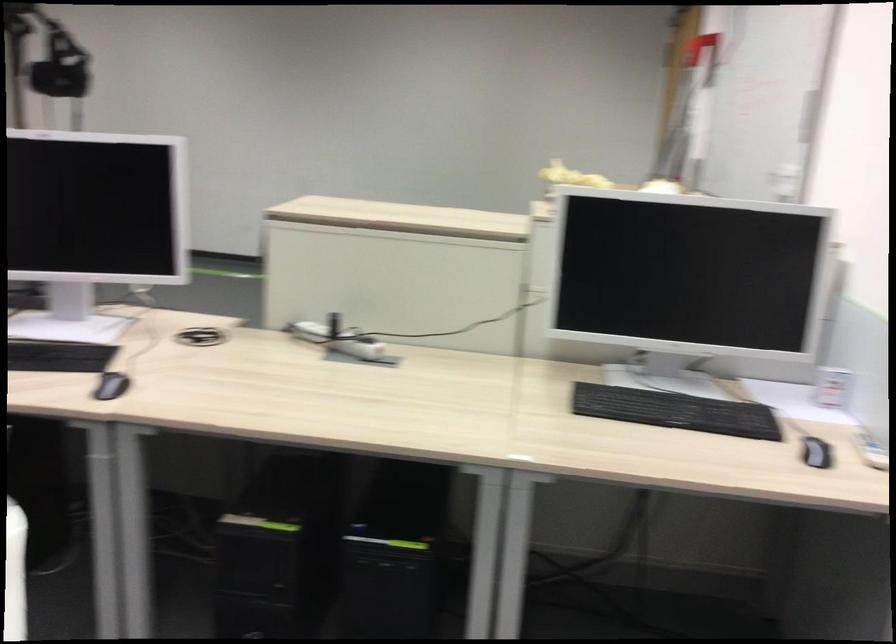
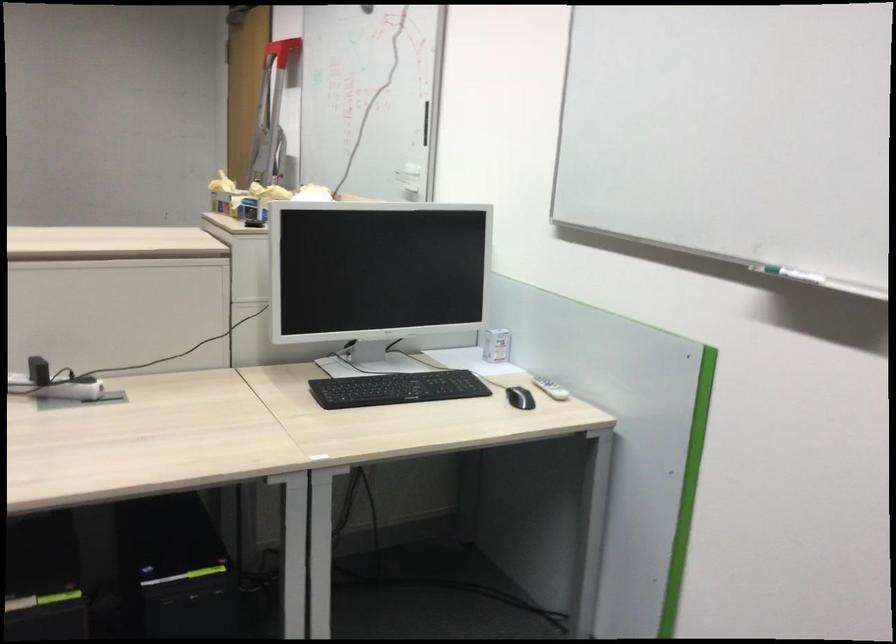
Where in the second image is the point corresponding to point 812,453 from the first image?

(520, 398)